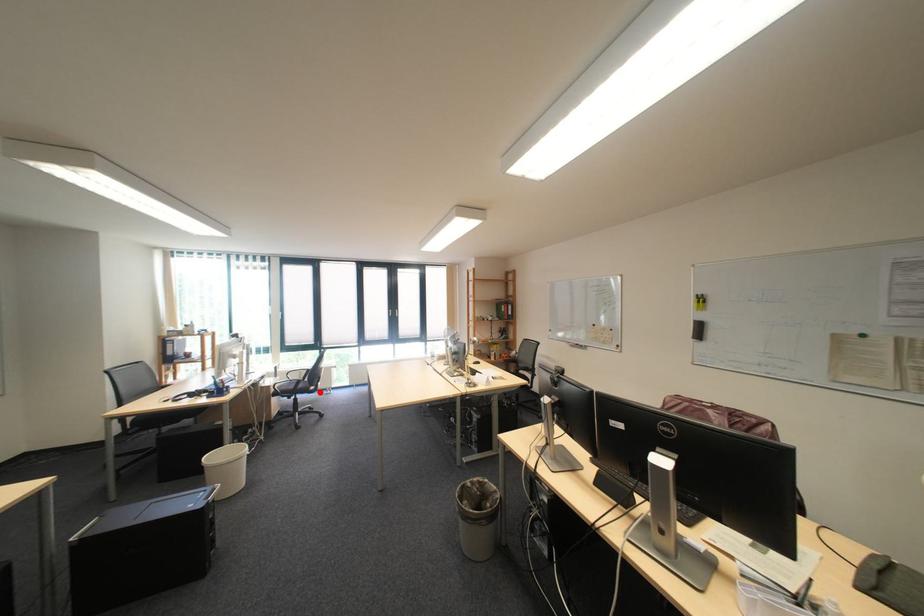
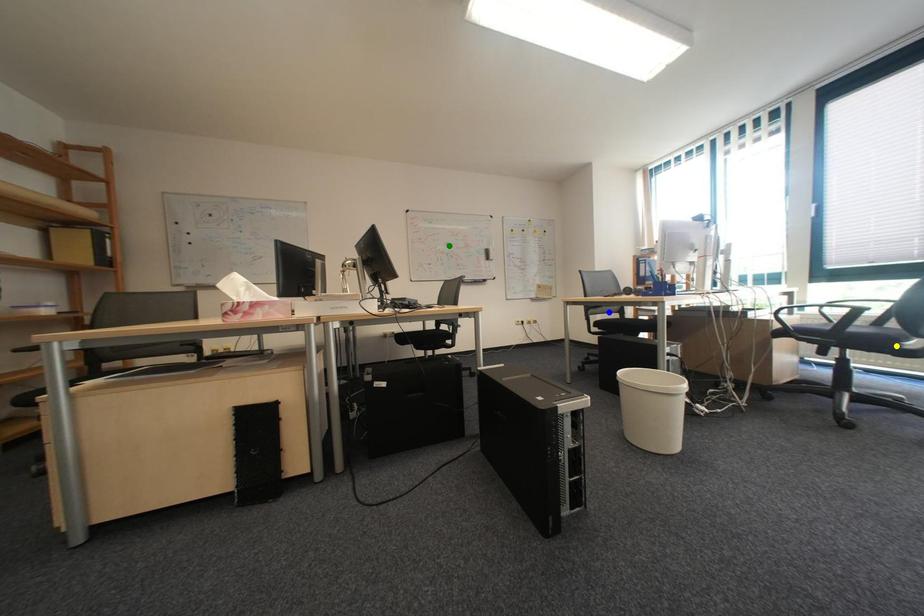
Question: I am providing you with two images of the same scene from different viewpoints. A red point is marked on the first image. You are given multiple points on the second image. In image 2, which mark is for the same physical point as the one in image 1?

Choices:
 (A) blue point
 (B) green point
 (C) yellow point

Answer: (C)